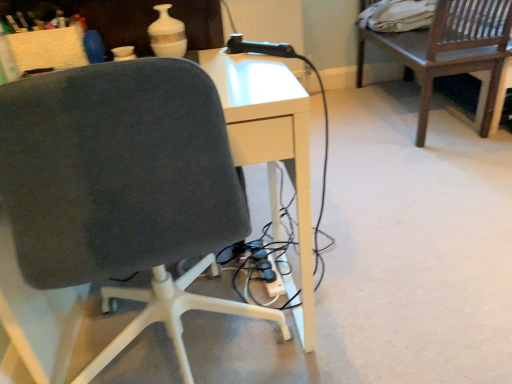
Question: From a real-world perspective, is dark wood chair at upper right below dark gray fabric chair at center?

Choices:
 (A) no
 (B) yes

Answer: (B)

Question: Would you say dark wood chair at upper right contains dark gray fabric chair at center?

Choices:
 (A) yes
 (B) no

Answer: (B)

Question: Is dark wood chair at upper right smaller than dark gray fabric chair at center?

Choices:
 (A) no
 (B) yes

Answer: (A)

Question: Does dark wood chair at upper right appear on the right side of dark gray fabric chair at center?

Choices:
 (A) no
 (B) yes

Answer: (B)

Question: Can we say dark wood chair at upper right lies outside dark gray fabric chair at center?

Choices:
 (A) no
 (B) yes

Answer: (B)

Question: Could you tell me if dark wood chair at upper right is turned towards dark gray fabric chair at center?

Choices:
 (A) no
 (B) yes

Answer: (A)

Question: From the image's perspective, is dark gray fabric chair at center under dark wood chair at upper right?

Choices:
 (A) no
 (B) yes

Answer: (B)

Question: Is dark gray fabric chair at center closer to camera compared to dark wood chair at upper right?

Choices:
 (A) yes
 (B) no

Answer: (A)

Question: Does dark gray fabric chair at center lie behind dark wood chair at upper right?

Choices:
 (A) no
 (B) yes

Answer: (A)

Question: Is dark gray fabric chair at center thinner than dark wood chair at upper right?

Choices:
 (A) yes
 (B) no

Answer: (B)

Question: Is dark gray fabric chair at center aimed at dark wood chair at upper right?

Choices:
 (A) yes
 (B) no

Answer: (B)

Question: Considering the relative positions of dark gray fabric chair at center and dark wood chair at upper right in the image provided, is dark gray fabric chair at center to the right of dark wood chair at upper right from the viewer's perspective?

Choices:
 (A) no
 (B) yes

Answer: (A)

Question: Is dark wood chair at upper right to the left or to the right of dark gray fabric chair at center in the image?

Choices:
 (A) left
 (B) right

Answer: (B)